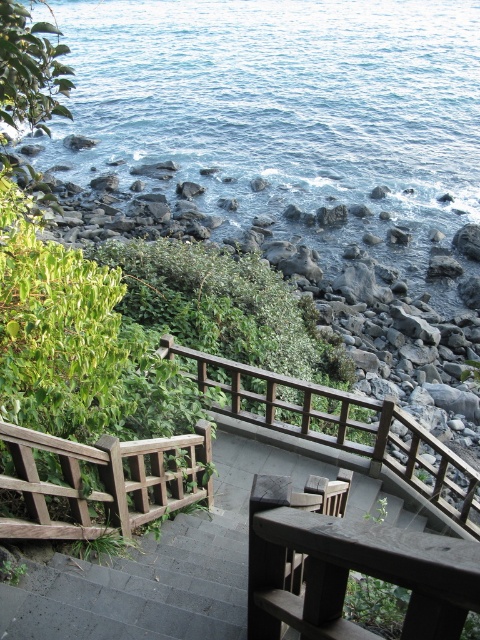
Question: Considering the real-world distances, which object is farthest from the weathered wood balustrade at lower left?

Choices:
 (A) dark gray stone steps at center
 (B) blue water at upper left
 (C) brown wooden balustrade at center

Answer: (B)

Question: Among these objects, which one is farthest from the camera?

Choices:
 (A) dark gray stone steps at center
 (B) brown wooden balustrade at center

Answer: (B)

Question: Is brown wooden balustrade at center positioned at the back of weathered wood balustrade at lower left?

Choices:
 (A) yes
 (B) no

Answer: (A)

Question: Is dark gray stone steps at center positioned behind weathered wood balustrade at lower left?

Choices:
 (A) yes
 (B) no

Answer: (A)

Question: Among these objects, which one is farthest from the camera?

Choices:
 (A) brown wooden balustrade at center
 (B) dark gray stone steps at center
 (C) blue water at upper left

Answer: (C)

Question: Is dark gray stone steps at center bigger than weathered wood balustrade at lower left?

Choices:
 (A) no
 (B) yes

Answer: (A)